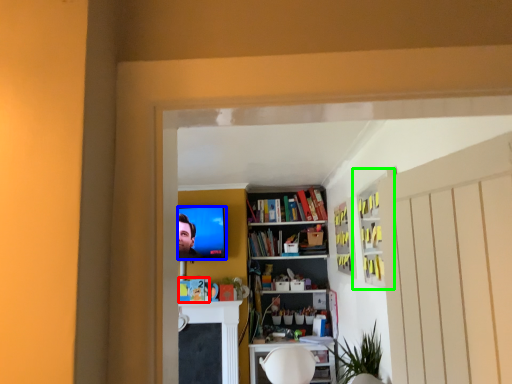
Question: Estimate the real-world distances between objects in this image. Which object is farther from book (highlighted by a red box), television (highlighted by a blue box) or cabinet (highlighted by a green box)?

Choices:
 (A) television
 (B) cabinet

Answer: (B)